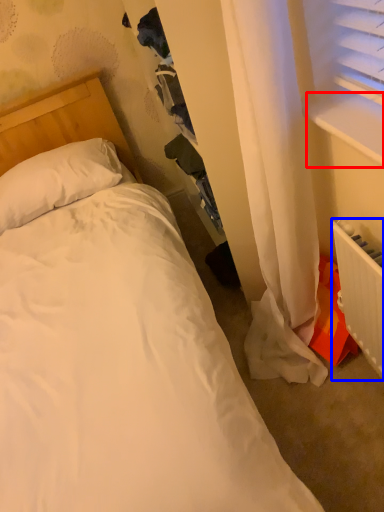
Question: Which of the following is the farthest to the observer, window sill (highlighted by a red box) or radiator (highlighted by a blue box)?

Choices:
 (A) window sill
 (B) radiator

Answer: (B)